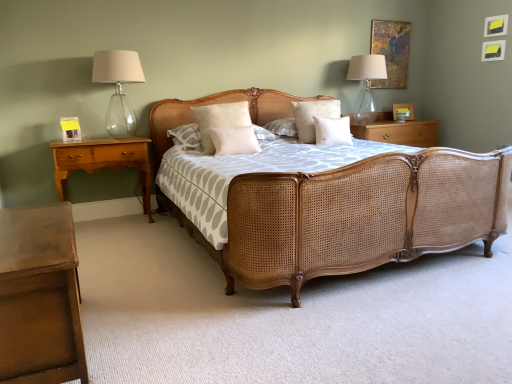
Identify the location of wooden nightstand at right, placed as the 3th nightstand when sorted from left to right. Image resolution: width=512 pixels, height=384 pixels. (396, 131).

This screenshot has width=512, height=384. What do you see at coordinates (391, 51) in the screenshot?
I see `wooden picture frame at upper right, which ranks as the first picture frame in top-to-bottom order` at bounding box center [391, 51].

What is the approximate height of white soft pillow at center, which is counted as the 3th pillow, starting from the right?

white soft pillow at center, which is counted as the 3th pillow, starting from the right, is 9.05 inches tall.

Identify the location of woven wood bed at center. (355, 216).

Find the location of `clear glass lampshade at left, arranged as the 2th bedside lamp when viewed from the back`. clear glass lampshade at left, arranged as the 2th bedside lamp when viewed from the back is located at coordinates (118, 87).

You are a GUI agent. You are given a task and a screenshot of the screen. Output one action in this format:
    pyautogui.click(x=<x>, y=<y>)
    Task: Click on the white soft pillow at center, which is the 4th pillow from right to left
    This screenshot has width=512, height=384.
    Given the screenshot: What is the action you would take?
    pyautogui.click(x=220, y=120)

The height and width of the screenshot is (384, 512). In order to click on wooden nightstand at lower left, which is the 2th nightstand in left-to-right order in this screenshot , I will do `click(40, 297)`.

Based on the photo, which point is more distant from viewer, (243, 200) or (309, 108)?

The point (309, 108) is farther from the camera.

From the image's perspective, which one is positioned lower, woven wood bed at center or beige cotton pillow at center, placed as the 2th pillow when sorted from right to left?

woven wood bed at center, from the image's perspective.

From the picture: Is woven wood bed at center next to beige cotton pillow at center, placed as the 2th pillow when sorted from right to left?

No, woven wood bed at center is not touching beige cotton pillow at center, placed as the 2th pillow when sorted from right to left.

Is woven wood bed at center at the left side of beige cotton pillow at center, marked as the 3th pillow in a left-to-right arrangement?

Yes, woven wood bed at center is to the left of beige cotton pillow at center, marked as the 3th pillow in a left-to-right arrangement.

Is wooden picture frame at upper right, the 2th picture frame from the bottom, positioned far away from white cotton pillow at center, the 1th pillow in the right-to-left sequence?

Indeed, wooden picture frame at upper right, the 2th picture frame from the bottom, is not near white cotton pillow at center, the 1th pillow in the right-to-left sequence.

Is wooden picture frame at upper right, which ranks as the 2th picture frame in front-to-back order, completely or partially outside of white cotton pillow at center, the 1th pillow in the right-to-left sequence?

Yes, wooden picture frame at upper right, which ranks as the 2th picture frame in front-to-back order, is not within white cotton pillow at center, the 1th pillow in the right-to-left sequence.

Can you tell me how much wooden picture frame at upper right, the 1th picture frame positioned from the right, and white cotton pillow at center, which is counted as the fourth pillow, starting from the left, differ in facing direction?

wooden picture frame at upper right, the 1th picture frame positioned from the right, and white cotton pillow at center, which is counted as the fourth pillow, starting from the left, are facing 2.67 degrees away from each other.

The image size is (512, 384). Identify the location of picture frame above the white cotton pillow at center, the 1th pillow in the right-to-left sequence (from the image's perspective). 391,51.

Does transparent glass lampshade at upper right, which is the 2th bedside lamp from left to right, have a larger size compared to beige cotton pillow at center, marked as the 3th pillow in a left-to-right arrangement?

Indeed, transparent glass lampshade at upper right, which is the 2th bedside lamp from left to right, has a larger size compared to beige cotton pillow at center, marked as the 3th pillow in a left-to-right arrangement.

Does point (383, 74) come farther from viewer compared to point (300, 141)?

Yes, it is behind point (300, 141).

Looking at this image, from a real-world perspective, is transparent glass lampshade at upper right, the first bedside lamp positioned from the right, positioned over beige cotton pillow at center, placed as the 2th pillow when sorted from right to left, based on gravity?

Yes.

From a real-world perspective, which is physically below, light brown wood nightstand at left, which is the third nightstand from right to left, or wooden nightstand at lower left, acting as the third nightstand starting from the back?

From a 3D spatial view, wooden nightstand at lower left, acting as the third nightstand starting from the back, is below.

From their relative heights in the image, would you say light brown wood nightstand at left, marked as the first nightstand in a left-to-right arrangement, is taller or shorter than wooden nightstand at lower left, which is the 2th nightstand in left-to-right order?

In the image, light brown wood nightstand at left, marked as the first nightstand in a left-to-right arrangement, appears to be taller than wooden nightstand at lower left, which is the 2th nightstand in left-to-right order.

Which is less distant, (110, 164) or (61, 207)?

Point (61, 207)

Which object is wider, light brown wood nightstand at left, the 2th nightstand from the back, or wooden nightstand at lower left, which is the 2th nightstand in left-to-right order?

wooden nightstand at lower left, which is the 2th nightstand in left-to-right order, is wider.

Considering the positions of objects transparent glass lampshade at upper right, which is the 2th bedside lamp from front to back, and wooden picture frame at upper right, the 2th picture frame from the bottom, in the image provided, who is more to the left, transparent glass lampshade at upper right, which is the 2th bedside lamp from front to back, or wooden picture frame at upper right, the 2th picture frame from the bottom,?

Positioned to the left is transparent glass lampshade at upper right, which is the 2th bedside lamp from front to back.

Is transparent glass lampshade at upper right, which is the 2th bedside lamp from front to back, beside wooden picture frame at upper right, which ranks as the 2th picture frame in front-to-back order?

They are not placed beside each other.

Consider the image. Does transparent glass lampshade at upper right, which is the 1th bedside lamp from back to front, have a larger size compared to wooden picture frame at upper right, the 1th picture frame viewed from the back?

Yes.

Can we say transparent glass lampshade at upper right, which is the 2th bedside lamp from front to back, lies outside wooden picture frame at upper right, the 1th picture frame viewed from the back?

transparent glass lampshade at upper right, which is the 2th bedside lamp from front to back, lies outside wooden picture frame at upper right, the 1th picture frame viewed from the back,'s area.

Can you confirm if wooden picture frame at upper right, the 1th picture frame positioned from the right, is shorter than clear glass lampshade at left, marked as the second bedside lamp in a right-to-left arrangement?

No.

Is wooden picture frame at upper right, the 2th picture frame from the bottom, positioned before clear glass lampshade at left, which ranks as the 1th bedside lamp in front-to-back order?

No, it is not.

Between wooden picture frame at upper right, the 2th picture frame from the bottom, and clear glass lampshade at left, arranged as the 2th bedside lamp when viewed from the back, which one has larger size?

clear glass lampshade at left, arranged as the 2th bedside lamp when viewed from the back.

From a real-world perspective, is wooden picture frame at upper right, which ranks as the first picture frame in top-to-bottom order, on clear glass lampshade at left, which ranks as the 1th bedside lamp in front-to-back order?

Yes, from a real-world perspective, wooden picture frame at upper right, which ranks as the first picture frame in top-to-bottom order, is on top of clear glass lampshade at left, which ranks as the 1th bedside lamp in front-to-back order.

From the image's perspective, which is above, woven wood bed at center or wooden nightstand at right, which is the 3th nightstand from front to back?

wooden nightstand at right, which is the 3th nightstand from front to back.

Is woven wood bed at center with wooden nightstand at right, the 1th nightstand viewed from the right?

They are not placed beside each other.

From the picture: How different are the orientations of woven wood bed at center and wooden nightstand at right, placed as the first nightstand when sorted from back to front, in degrees?

The angle between the facing direction of woven wood bed at center and the facing direction of wooden nightstand at right, placed as the first nightstand when sorted from back to front, is 0.595 degrees.

From the woven wood bed at center, count 4th pillows backward and point to it. Please provide its 2D coordinates.

[(313, 115)]

There is a wooden picture frame at upper right, which ranks as the 2th picture frame in front-to-back order. At what (x,y) coordinates should I click in order to perform the action: click on the 3rd pillow below it (from a real-world perspective). Please return your answer as a coordinate pair (x, y). The image size is (512, 384). Looking at the image, I should click on (332, 131).

Estimate the real-world distances between objects in this image. Which object is closer to white soft pillow at center, which appears as the second pillow when viewed from the left, white soft pillow at center, placed as the 1th pillow when sorted from left to right, or light brown wood nightstand at left, the 2th nightstand from the back?

white soft pillow at center, placed as the 1th pillow when sorted from left to right, is positioned closer to the anchor white soft pillow at center, which appears as the second pillow when viewed from the left.

From the image, which object appears to be nearer to beige cotton pillow at center, placed as the 2th pillow when sorted from right to left, wooden nightstand at lower left, which is the 2th nightstand in left-to-right order, or woven wood bed at center?

The object closer to beige cotton pillow at center, placed as the 2th pillow when sorted from right to left, is woven wood bed at center.

From the image, which object appears to be farther from wooden picture frame at upper right, which ranks as the 2th picture frame in front-to-back order, white soft pillow at center, which appears as the second pillow when viewed from the left, or wooden nightstand at lower left, the second nightstand viewed from the right?

Among the two, wooden nightstand at lower left, the second nightstand viewed from the right, is located further to wooden picture frame at upper right, which ranks as the 2th picture frame in front-to-back order.

Considering their positions, is transparent glass lampshade at upper right, the first bedside lamp positioned from the right, positioned further to light brown wood nightstand at left, which appears as the second nightstand when viewed from the front, than wooden nightstand at right, placed as the 3th nightstand when sorted from left to right?

Based on the image, transparent glass lampshade at upper right, the first bedside lamp positioned from the right, appears to be further to light brown wood nightstand at left, which appears as the second nightstand when viewed from the front.

From the image, which object appears to be nearer to beige cotton pillow at center, placed as the 2th pillow when sorted from right to left, matte yellow picture frame at left, marked as the first picture frame in a left-to-right arrangement, or white cotton pillow at center, the 1th pillow in the right-to-left sequence?

white cotton pillow at center, the 1th pillow in the right-to-left sequence, is closer to beige cotton pillow at center, placed as the 2th pillow when sorted from right to left.

Looking at the image, which one is located further to white soft pillow at center, which is counted as the 3th pillow, starting from the right, white soft pillow at center, which is the 4th pillow from right to left, or matte yellow picture frame at left, the second picture frame in the right-to-left sequence?

The object further to white soft pillow at center, which is counted as the 3th pillow, starting from the right, is matte yellow picture frame at left, the second picture frame in the right-to-left sequence.

Based on their spatial positions, is wooden nightstand at lower left, positioned as the first nightstand in front-to-back order, or beige cotton pillow at center, placed as the 2th pillow when sorted from right to left, further from matte yellow picture frame at left, which ranks as the second picture frame in back-to-front order?

wooden nightstand at lower left, positioned as the first nightstand in front-to-back order, lies further to matte yellow picture frame at left, which ranks as the second picture frame in back-to-front order, than the other object.

When comparing their distances from transparent glass lampshade at upper right, the first bedside lamp positioned from the right, does white soft pillow at center, which is the 4th pillow from right to left, or white soft pillow at center, which is counted as the 3th pillow, starting from the right, seem further?

Among the two, white soft pillow at center, which is counted as the 3th pillow, starting from the right, is located further to transparent glass lampshade at upper right, the first bedside lamp positioned from the right.

The width and height of the screenshot is (512, 384). I want to click on nightstand between wooden nightstand at lower left, which is the 2th nightstand in left-to-right order, and matte yellow picture frame at left, which ranks as the second picture frame in back-to-front order, in the front-back direction, so tap(103, 161).

Where is `bed between wooden nightstand at lower left, which is the 2th nightstand in left-to-right order, and matte yellow picture frame at left, positioned as the 1th picture frame in bottom-to-top order, along the z-axis`? This screenshot has width=512, height=384. bed between wooden nightstand at lower left, which is the 2th nightstand in left-to-right order, and matte yellow picture frame at left, positioned as the 1th picture frame in bottom-to-top order, along the z-axis is located at coordinates (355, 216).

Where is `nightstand located between white soft pillow at center, which is the 4th pillow from right to left, and wooden picture frame at upper right, which ranks as the 2th picture frame in front-to-back order, in the left-right direction`? This screenshot has width=512, height=384. nightstand located between white soft pillow at center, which is the 4th pillow from right to left, and wooden picture frame at upper right, which ranks as the 2th picture frame in front-to-back order, in the left-right direction is located at coordinates (396, 131).

Identify the location of bedside lamp located between light brown wood nightstand at left, marked as the first nightstand in a left-to-right arrangement, and beige cotton pillow at center, placed as the 2th pillow when sorted from right to left, in the left-right direction. pyautogui.click(x=118, y=87).